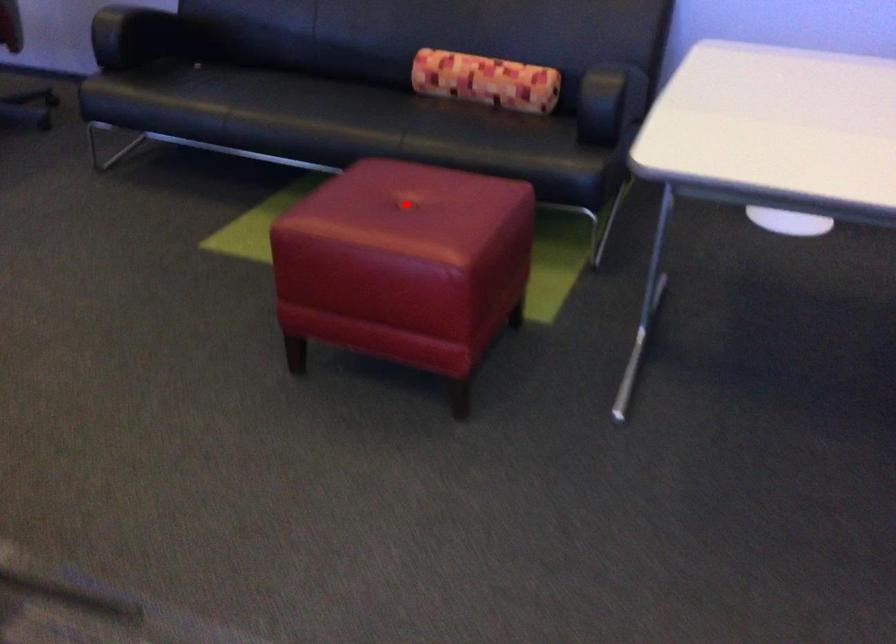
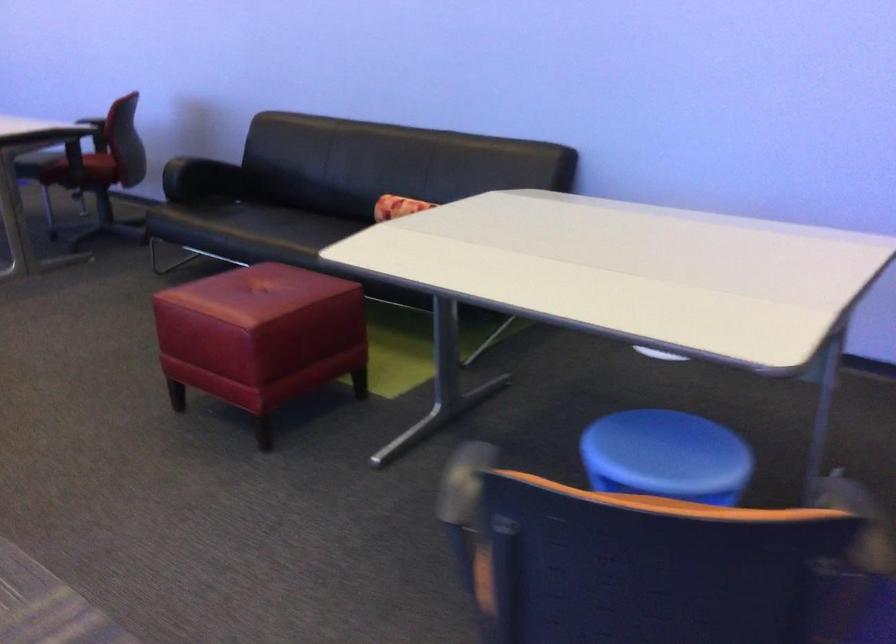
Where in the second image is the point corresponding to the highlighted location from the first image?

(260, 292)